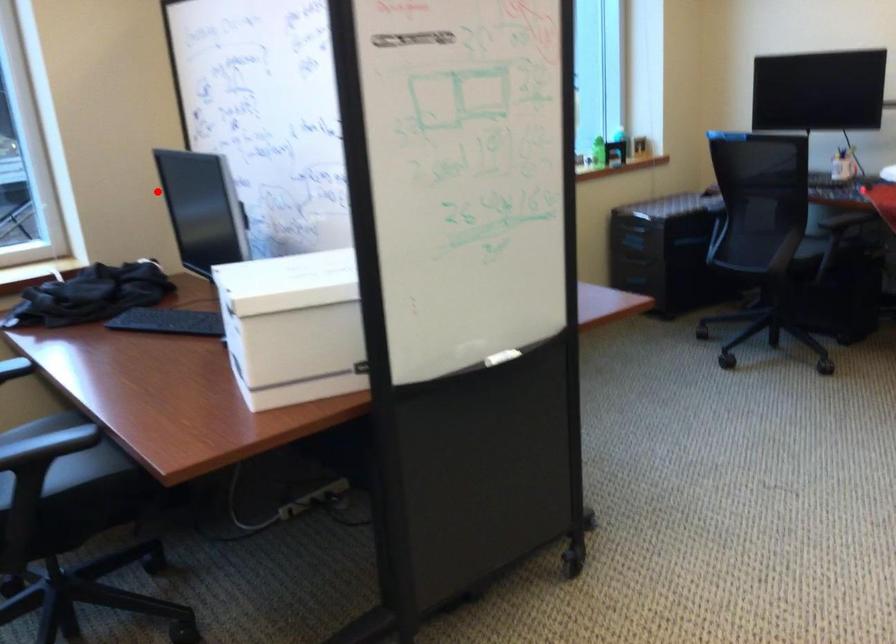
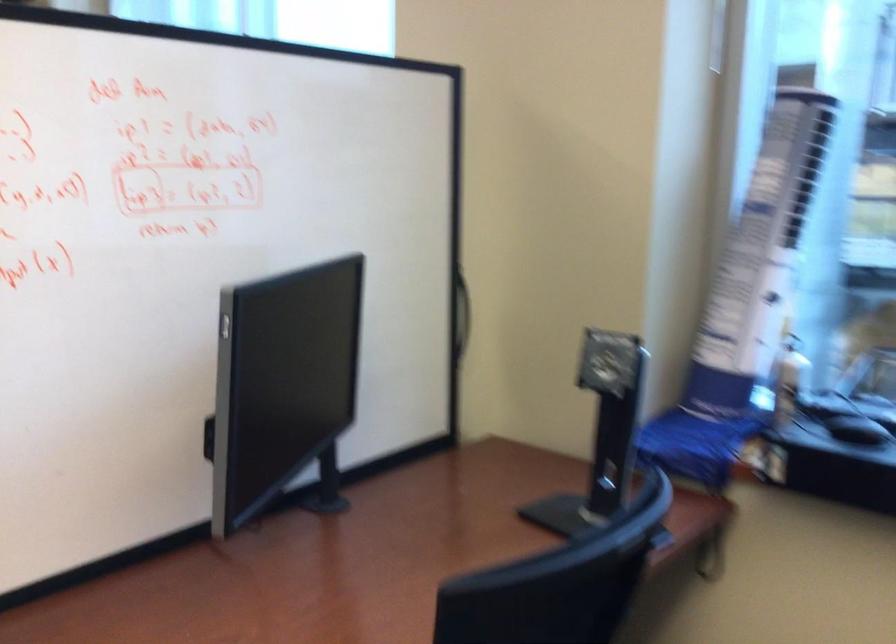
The point at the highlighted location is marked in the first image. Where is the corresponding point in the second image?

(461, 313)